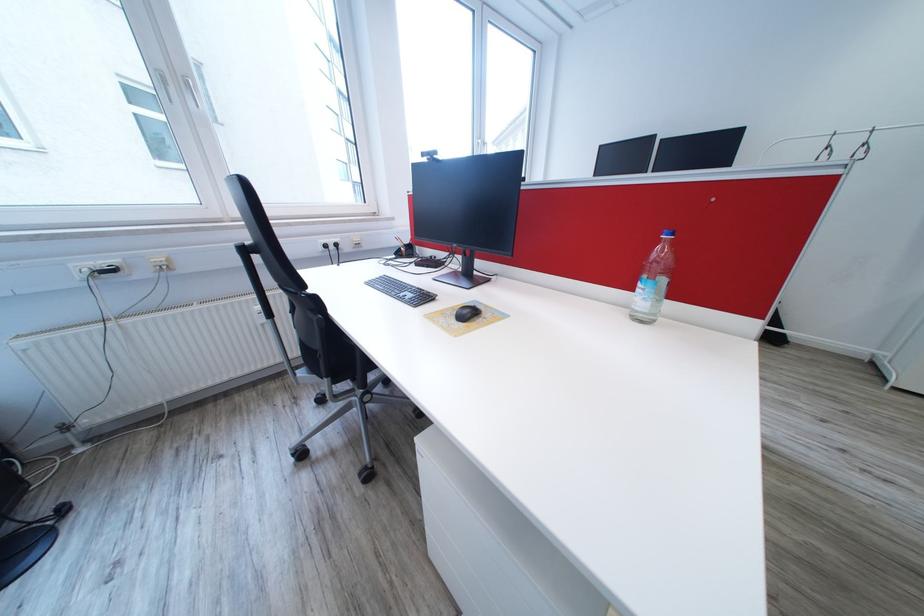
Identify the location of white electrical plug. (89, 270).